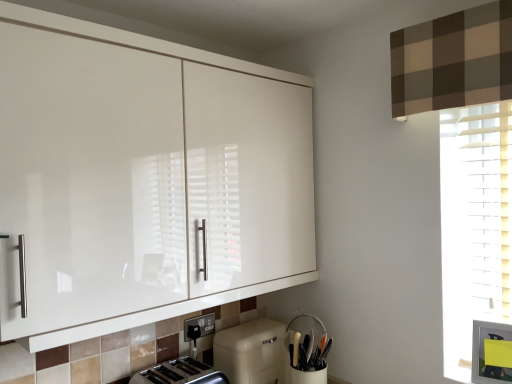
Question: Does beige matte dishwasher at lower center have a lesser height compared to black plastic electric outlet at lower center?

Choices:
 (A) no
 (B) yes

Answer: (A)

Question: From a real-world perspective, is beige matte dishwasher at lower center physically below black plastic electric outlet at lower center?

Choices:
 (A) yes
 (B) no

Answer: (A)

Question: Could you tell me if beige matte dishwasher at lower center is facing black plastic electric outlet at lower center?

Choices:
 (A) yes
 (B) no

Answer: (B)

Question: Is beige matte dishwasher at lower center turned away from black plastic electric outlet at lower center?

Choices:
 (A) yes
 (B) no

Answer: (B)

Question: Is beige matte dishwasher at lower center in front of black plastic electric outlet at lower center?

Choices:
 (A) yes
 (B) no

Answer: (A)

Question: From a real-world perspective, is silver metallic toaster at lower center physically located above or below beige matte dishwasher at lower center?

Choices:
 (A) above
 (B) below

Answer: (A)

Question: Based on their positions, is silver metallic toaster at lower center located to the left or right of beige matte dishwasher at lower center?

Choices:
 (A) left
 (B) right

Answer: (A)

Question: Looking at their shapes, would you say silver metallic toaster at lower center is wider or thinner than beige matte dishwasher at lower center?

Choices:
 (A) wide
 (B) thin

Answer: (A)

Question: Considering the positions of point (224, 375) and point (272, 360), is point (224, 375) closer or farther from the camera than point (272, 360)?

Choices:
 (A) farther
 (B) closer

Answer: (B)

Question: Relative to beige matte dishwasher at lower center, is white matte utensil holder at lower center in front or behind?

Choices:
 (A) behind
 (B) front

Answer: (B)

Question: From a real-world perspective, is white matte utensil holder at lower center above or below beige matte dishwasher at lower center?

Choices:
 (A) above
 (B) below

Answer: (A)

Question: Considering the positions of white matte utensil holder at lower center and beige matte dishwasher at lower center in the image, is white matte utensil holder at lower center wider or thinner than beige matte dishwasher at lower center?

Choices:
 (A) thin
 (B) wide

Answer: (B)

Question: Is point (315, 370) closer or farther from the camera than point (249, 362)?

Choices:
 (A) farther
 (B) closer

Answer: (A)

Question: Considering their positions, is silver metallic toaster at lower center located in front of or behind black plastic electric outlet at lower center?

Choices:
 (A) behind
 (B) front

Answer: (B)

Question: From the image's perspective, relative to black plastic electric outlet at lower center, is silver metallic toaster at lower center above or below?

Choices:
 (A) above
 (B) below

Answer: (B)